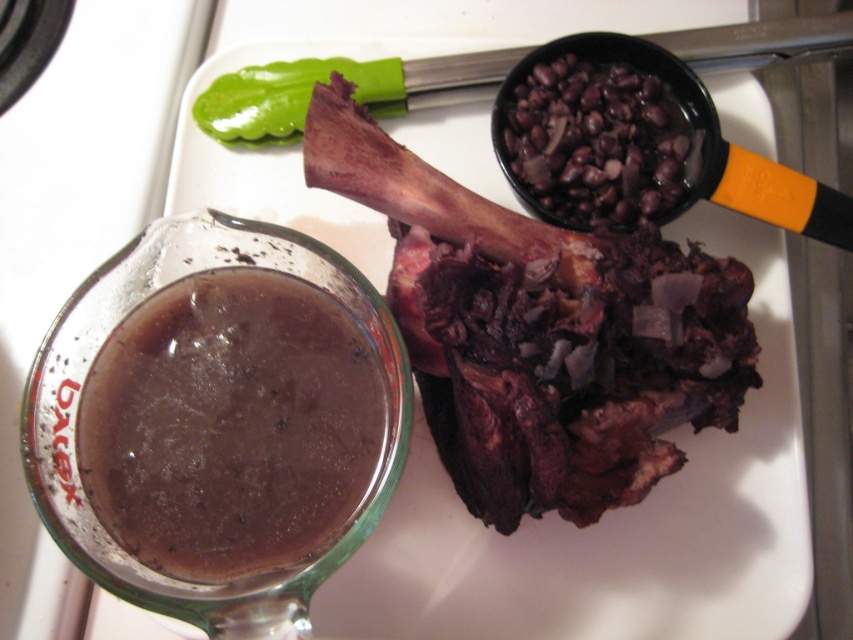
Question: Is dark brown meat at center to the right of black matte beans at upper right from the viewer's perspective?

Choices:
 (A) yes
 (B) no

Answer: (B)

Question: Is translucent glass gravy at lower left smaller than black matte beans at upper right?

Choices:
 (A) yes
 (B) no

Answer: (B)

Question: Which of the following is the closest to the observer?

Choices:
 (A) black matte beans at upper right
 (B) dark brown meat at center
 (C) translucent glass gravy at lower left

Answer: (C)

Question: Which object is positioned closest to the dark brown meat at center?

Choices:
 (A) black matte beans at upper right
 (B) translucent glass gravy at lower left

Answer: (A)

Question: Which of these objects is positioned closest to the translucent glass gravy at lower left?

Choices:
 (A) black matte beans at upper right
 (B) dark brown meat at center

Answer: (B)

Question: Does translucent glass gravy at lower left have a larger size compared to black matte beans at upper right?

Choices:
 (A) yes
 (B) no

Answer: (A)